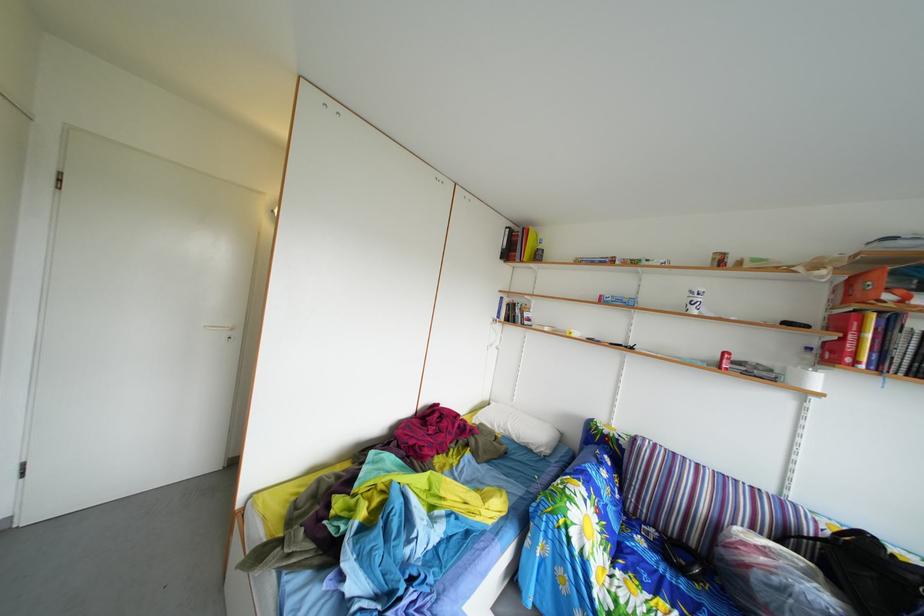
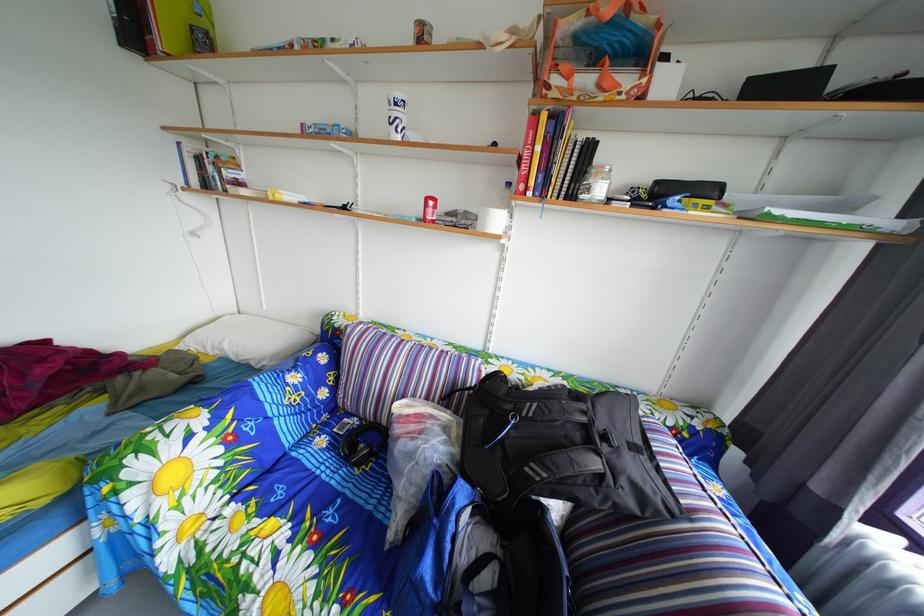
Find the pixel in the second image that matches pixel 663 539 in the first image.

(367, 428)